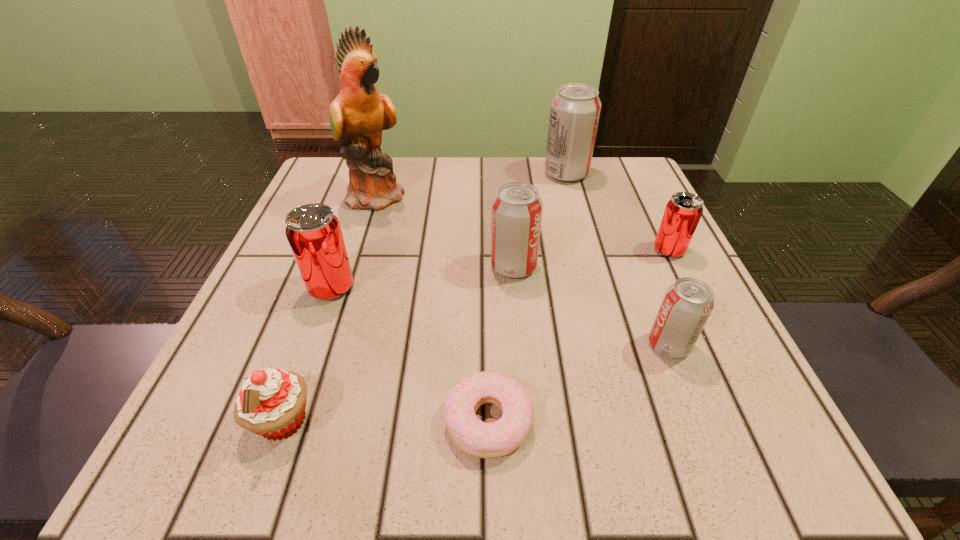
Locate an element on the screen. The width and height of the screenshot is (960, 540). free spot between the second tallest object and the sixth farthest object is located at coordinates (617, 259).

The image size is (960, 540). I want to click on free area in between the pink cupcake and the biggest gray soda can, so click(x=424, y=298).

In order to click on free point between the tallest object and the biggest gray soda can in this screenshot , I will do `click(472, 185)`.

This screenshot has height=540, width=960. I want to click on free space between the pink doughnut and the green parrot, so click(433, 308).

At what (x,y) coordinates should I click in order to perform the action: click on free point between the pink doughnut and the nearer red soda can. Please return your answer as a coordinate pair (x, y). This screenshot has height=540, width=960. Looking at the image, I should click on (410, 354).

Locate an element on the screen. empty location between the pink cupcake and the bigger red soda can is located at coordinates (307, 354).

This screenshot has height=540, width=960. What are the coordinates of `empty location between the nearest gray soda can and the fourth soda can from right to left` in the screenshot? It's located at (591, 306).

The height and width of the screenshot is (540, 960). I want to click on empty space between the left red soda can and the leftmost gray soda can, so click(x=422, y=277).

Identify the location of object identified as the closest to the rightmost object. (687, 304).

This screenshot has height=540, width=960. I want to click on object that stands as the seventh closest to the doughnut, so click(575, 109).